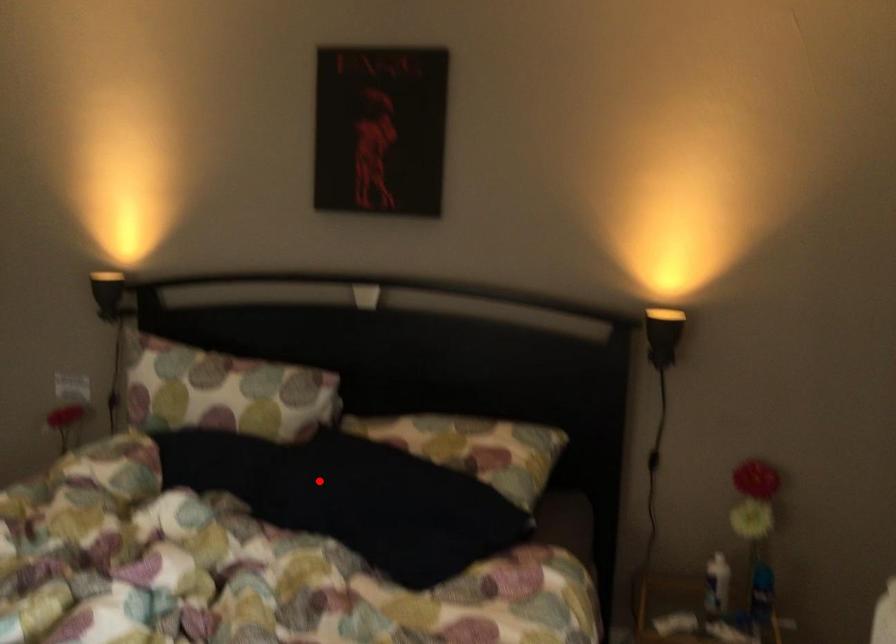
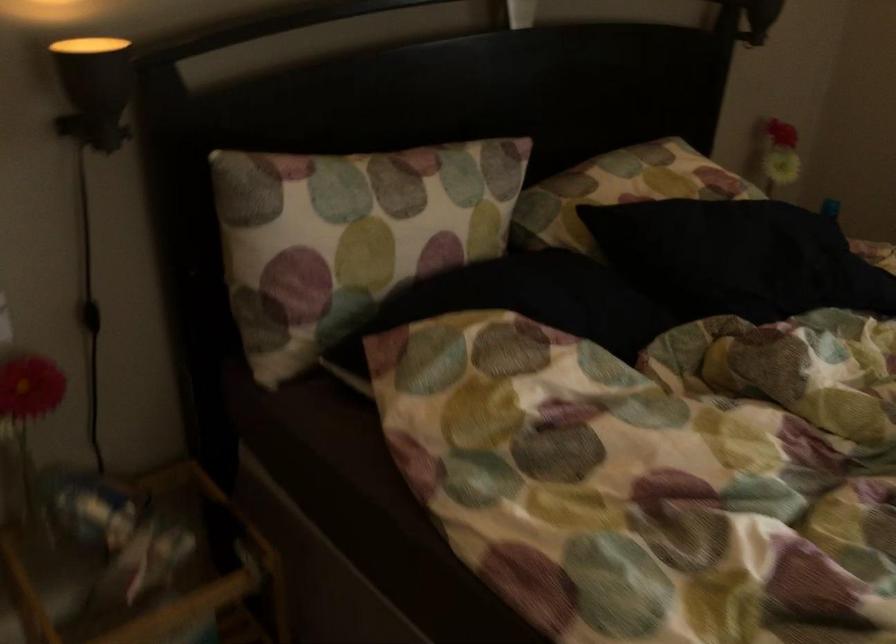
Question: I am providing you with two images of the same scene from different viewpoints. A red point is shown in image1. For the corresponding object point in image2, is it positioned nearer or farther from the camera?

Choices:
 (A) Nearer
 (B) Farther

Answer: (A)